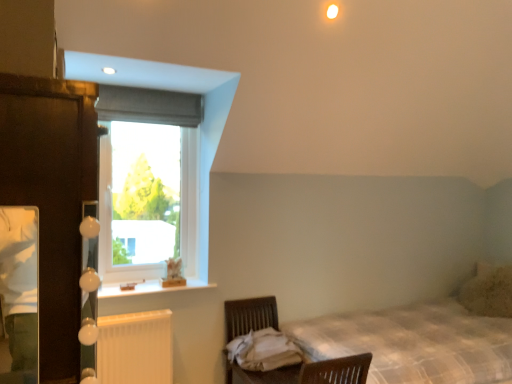
Question: Can you confirm if beige textured pillow at right is bigger than white plastic radiator at lower left?

Choices:
 (A) yes
 (B) no

Answer: (A)

Question: Is beige textured pillow at right completely or partially outside of white plastic radiator at lower left?

Choices:
 (A) no
 (B) yes

Answer: (B)

Question: From a real-world perspective, is beige textured pillow at right located higher than white plastic radiator at lower left?

Choices:
 (A) no
 (B) yes

Answer: (B)

Question: From a real-world perspective, is beige textured pillow at right below white plastic radiator at lower left?

Choices:
 (A) yes
 (B) no

Answer: (B)

Question: From the image's perspective, is beige textured pillow at right on white plastic radiator at lower left?

Choices:
 (A) no
 (B) yes

Answer: (B)

Question: In terms of height, does clear glass window at upper left look taller or shorter compared to white plastic radiator at lower left?

Choices:
 (A) tall
 (B) short

Answer: (A)

Question: From a real-world perspective, is clear glass window at upper left physically located above or below white plastic radiator at lower left?

Choices:
 (A) above
 (B) below

Answer: (A)

Question: From the image's perspective, relative to white plastic radiator at lower left, is clear glass window at upper left above or below?

Choices:
 (A) below
 (B) above

Answer: (B)

Question: In terms of width, does clear glass window at upper left look wider or thinner when compared to white plastic radiator at lower left?

Choices:
 (A) thin
 (B) wide

Answer: (B)

Question: Choose the correct answer: Is white plastic radiator at lower left inside beige textured pillow at right or outside it?

Choices:
 (A) outside
 (B) inside

Answer: (A)

Question: From a real-world perspective, is white plastic radiator at lower left physically located above or below beige textured pillow at right?

Choices:
 (A) below
 (B) above

Answer: (A)

Question: Would you say white plastic radiator at lower left is to the left or to the right of beige textured pillow at right in the picture?

Choices:
 (A) right
 (B) left

Answer: (B)

Question: Is point (168, 352) positioned closer to the camera than point (483, 301)?

Choices:
 (A) closer
 (B) farther

Answer: (A)

Question: Is white plastic radiator at lower left inside the boundaries of dark wood armoire at left, or outside?

Choices:
 (A) outside
 (B) inside

Answer: (A)

Question: Based on their positions, is white plastic radiator at lower left located to the left or right of dark wood armoire at left?

Choices:
 (A) left
 (B) right

Answer: (B)